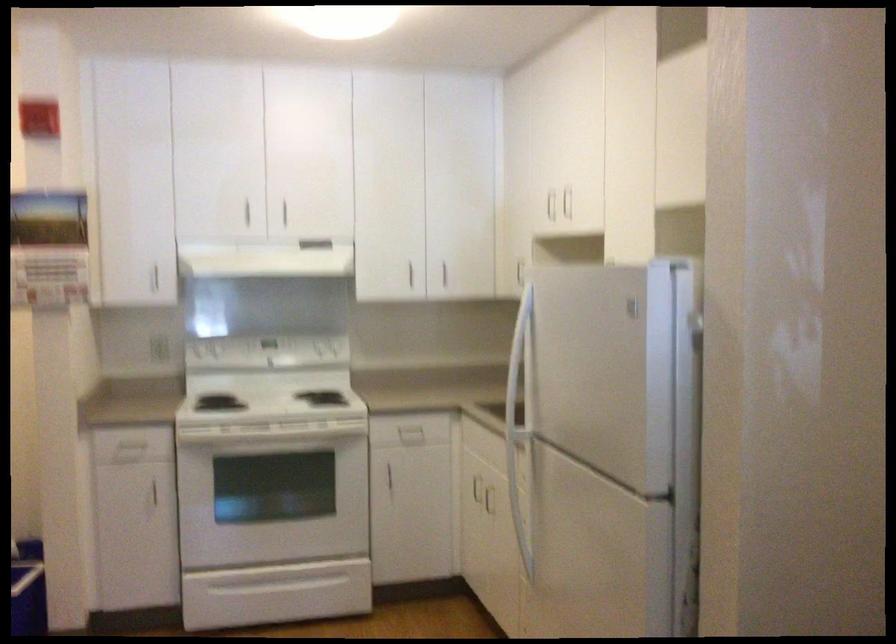
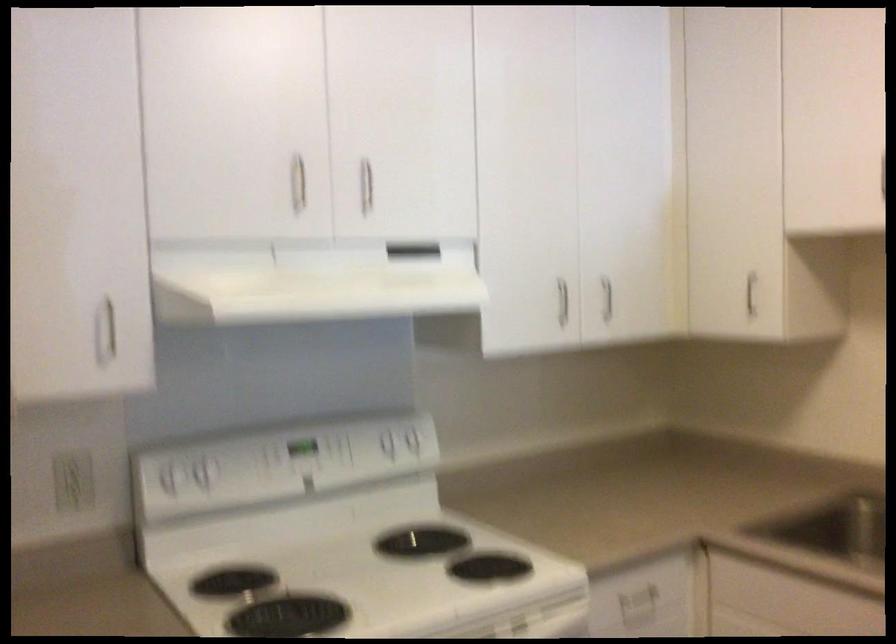
Where in the second image is the point corresponding to (412,270) from the first image?

(562, 301)